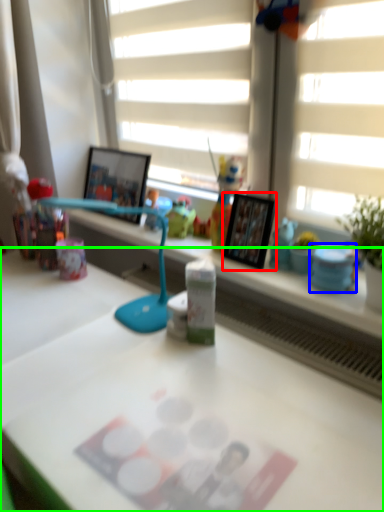
Question: Based on their relative distances, which object is nearer to picture frame (highlighted by a red box)? Choose from stationery (highlighted by a blue box) and desk (highlighted by a green box).

Choices:
 (A) stationery
 (B) desk

Answer: (A)